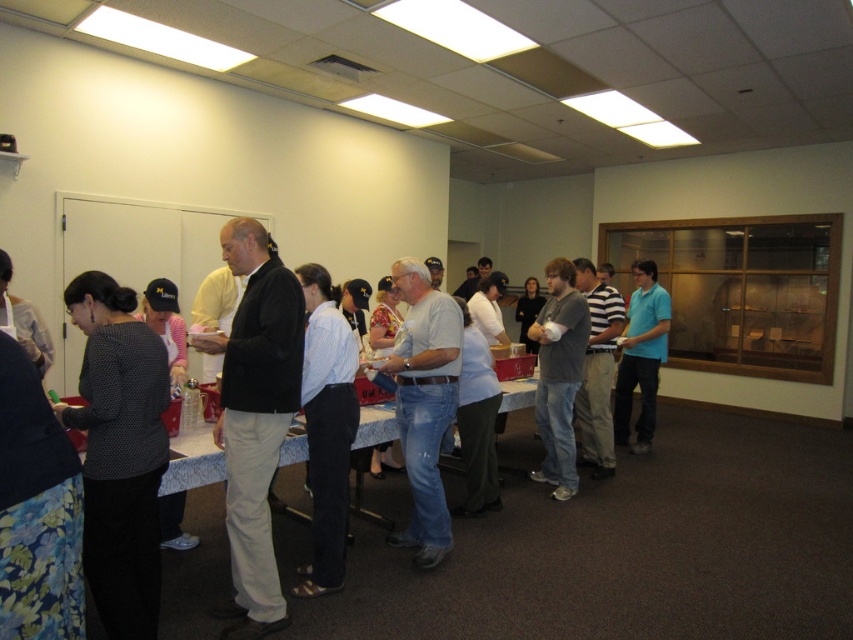
Does light blue striped shirt at center lie behind striped cotton shirt at center?

No, it is in front of striped cotton shirt at center.

Does point (329, 413) come behind point (592, 392)?

No, (329, 413) is closer to viewer.

The width and height of the screenshot is (853, 640). I want to click on light blue striped shirt at center, so click(x=326, y=428).

Can you confirm if polka dot blouse at left is shorter than light blue striped shirt at center?

Yes.

Can you confirm if polka dot blouse at left is positioned to the left of light blue striped shirt at center?

Yes, polka dot blouse at left is to the left of light blue striped shirt at center.

What do you see at coordinates (119, 452) in the screenshot?
I see `polka dot blouse at left` at bounding box center [119, 452].

Find the location of a particular element. polka dot blouse at left is located at coordinates (119, 452).

Does blue cotton shirt at center appear on the left side of striped cotton shirt at center?

No, blue cotton shirt at center is not to the left of striped cotton shirt at center.

Does blue cotton shirt at center have a greater width compared to striped cotton shirt at center?

Correct, the width of blue cotton shirt at center exceeds that of striped cotton shirt at center.

The height and width of the screenshot is (640, 853). Find the location of `blue cotton shirt at center`. blue cotton shirt at center is located at coordinates (641, 356).